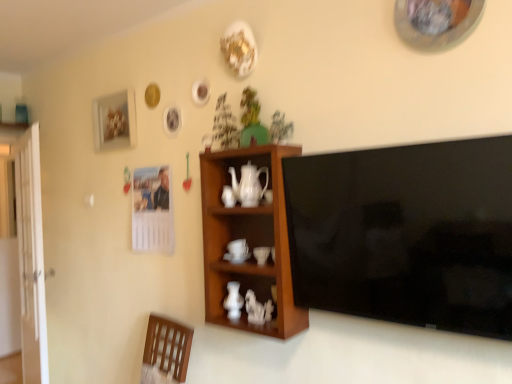
This screenshot has width=512, height=384. Find the location of `white glossy coffee cup at center, which ranks as the first coffee cup in front-to-back order`. white glossy coffee cup at center, which ranks as the first coffee cup in front-to-back order is located at coordinates (261, 255).

I want to click on matte white picture frame at upper left, so click(x=115, y=121).

Find the location of a particular element. This screenshot has width=512, height=384. white glossy vase at center is located at coordinates pyautogui.click(x=233, y=300).

Describe the element at coordinates (248, 241) in the screenshot. I see `wooden cabinet at center` at that location.

Locate an element on the screen. green matte houseplant at upper center, placed as the second houseplant when sorted from right to left is located at coordinates (225, 126).

What do you see at coordinates (225, 126) in the screenshot? I see `green matte houseplant at upper center, placed as the second houseplant when sorted from right to left` at bounding box center [225, 126].

This screenshot has height=384, width=512. Find the location of `white glossy coffee cup at center, the first coffee cup positioned from the right`. white glossy coffee cup at center, the first coffee cup positioned from the right is located at coordinates (261, 255).

Considering the relative sizes of white glossy vase at center and black glossy flat-screen tv at right in the image provided, is white glossy vase at center wider than black glossy flat-screen tv at right?

Incorrect, the width of white glossy vase at center does not surpass that of black glossy flat-screen tv at right.

Where is `vase that is behind the black glossy flat-screen tv at right`? vase that is behind the black glossy flat-screen tv at right is located at coordinates (233, 300).

Which is farther, (238, 292) or (283, 170)?

Positioned behind is point (238, 292).

Locate an element on the screen. This screenshot has width=512, height=384. the 1st coffee cup in front of the white glossy vase at center is located at coordinates click(238, 247).

Is white ceramic coffee cup at center, which ranks as the second coffee cup in right-to-left order, positioned before white glossy vase at center?

Yes, white ceramic coffee cup at center, which ranks as the second coffee cup in right-to-left order, is closer to the camera.

Does white ceramic coffee cup at center, the second coffee cup in the front-to-back sequence, have a lesser height compared to white glossy vase at center?

Yes, white ceramic coffee cup at center, the second coffee cup in the front-to-back sequence, is shorter than white glossy vase at center.

Considering the relative positions of white ceramic coffee cup at center, which ranks as the second coffee cup in right-to-left order, and white glossy vase at center in the image provided, is white ceramic coffee cup at center, which ranks as the second coffee cup in right-to-left order, to the left of white glossy vase at center from the viewer's perspective?

Incorrect, white ceramic coffee cup at center, which ranks as the second coffee cup in right-to-left order, is not on the left side of white glossy vase at center.

Do you think white glossy coffee cup at center, which appears as the 2th coffee cup when viewed from the back, is within wooden cabinet at center, or outside of it?

white glossy coffee cup at center, which appears as the 2th coffee cup when viewed from the back, is inside wooden cabinet at center.

Can you confirm if white glossy coffee cup at center, which appears as the 2th coffee cup when viewed from the back, is shorter than wooden cabinet at center?

Yes, white glossy coffee cup at center, which appears as the 2th coffee cup when viewed from the back, is shorter than wooden cabinet at center.

From a real-world perspective, does white glossy coffee cup at center, the first coffee cup positioned from the right, sit lower than wooden cabinet at center?

Yes.

Is white glossy coffee cup at center, which appears as the 2th coffee cup when viewed from the back, turned away from wooden cabinet at center?

Yes.

Which of these two, black glossy flat-screen tv at right or green matte houseplant at upper center, which is the first houseplant from right to left, is wider?

black glossy flat-screen tv at right is wider.

Are black glossy flat-screen tv at right and green matte houseplant at upper center, which is the first houseplant from right to left, located far from each other?

No, black glossy flat-screen tv at right is in close proximity to green matte houseplant at upper center, which is the first houseplant from right to left.

Can you tell me how much black glossy flat-screen tv at right and green matte houseplant at upper center, the 2th houseplant in the left-to-right sequence, differ in facing direction?

black glossy flat-screen tv at right and green matte houseplant at upper center, the 2th houseplant in the left-to-right sequence, are facing 1.69 degrees away from each other.

The width and height of the screenshot is (512, 384). I want to click on the 1st houseplant behind the black glossy flat-screen tv at right, starting your count from the anchor, so click(252, 120).

Which is behind, matte white picture frame at upper left or wooden cabinet at center?

matte white picture frame at upper left is further away from the camera.

Considering the positions of objects matte white picture frame at upper left and wooden cabinet at center in the image provided, who is more to the left, matte white picture frame at upper left or wooden cabinet at center?

Positioned to the left is matte white picture frame at upper left.

Does point (120, 100) come in front of point (246, 323)?

No, it is behind (246, 323).

This screenshot has height=384, width=512. I want to click on cabinetry lying below the matte white picture frame at upper left (from the image's perspective), so click(x=248, y=241).

Based on the photo, from the image's perspective, between white glossy door at left and white glossy coffee cup at center, which ranks as the first coffee cup in front-to-back order, which one is located above?

From the image's view, white glossy coffee cup at center, which ranks as the first coffee cup in front-to-back order, is above.

Between point (30, 259) and point (266, 254), which one is positioned in front?

The point (266, 254) is in front.

Is white glossy door at left bigger or smaller than white glossy coffee cup at center, the first coffee cup positioned from the right?

Clearly, white glossy door at left is larger in size than white glossy coffee cup at center, the first coffee cup positioned from the right.

Which of these two, white glossy door at left or white glossy coffee cup at center, which ranks as the first coffee cup in front-to-back order, is wider?

white glossy door at left is wider.

I want to click on houseplant that is the 2nd object located behind the white glossy coffee cup at center, which appears as the 2th coffee cup when viewed from the back, so click(x=225, y=126).

Considering the sizes of green matte houseplant at upper center, placed as the second houseplant when sorted from right to left, and white glossy coffee cup at center, the first coffee cup positioned from the right, in the image, is green matte houseplant at upper center, placed as the second houseplant when sorted from right to left, bigger or smaller than white glossy coffee cup at center, the first coffee cup positioned from the right,?

Considering their sizes, green matte houseplant at upper center, placed as the second houseplant when sorted from right to left, takes up more space than white glossy coffee cup at center, the first coffee cup positioned from the right.

From the image's perspective, which is below, green matte houseplant at upper center, the 1th houseplant in the left-to-right sequence, or white glossy coffee cup at center, which appears as the 2th coffee cup when viewed from the back?

From the image's view, white glossy coffee cup at center, which appears as the 2th coffee cup when viewed from the back, is below.

In terms of width, does green matte houseplant at upper center, the 1th houseplant in the left-to-right sequence, look wider or thinner when compared to white glossy coffee cup at center, which is the second coffee cup in left-to-right order?

Considering their sizes, green matte houseplant at upper center, the 1th houseplant in the left-to-right sequence, looks broader than white glossy coffee cup at center, which is the second coffee cup in left-to-right order.

This screenshot has width=512, height=384. In order to click on vase behind the black glossy flat-screen tv at right in this screenshot , I will do `click(233, 300)`.

Where is `the 1st coffee cup to the right when counting from the white glossy vase at center`? The height and width of the screenshot is (384, 512). the 1st coffee cup to the right when counting from the white glossy vase at center is located at coordinates (238, 247).

Based on the photo, estimate the real-world distances between objects in this image. Which object is further from green matte houseplant at upper center, the 1th houseplant in the left-to-right sequence, black glossy flat-screen tv at right or white ceramic coffee cup at center, which ranks as the second coffee cup in right-to-left order?

Among the two, black glossy flat-screen tv at right is located further to green matte houseplant at upper center, the 1th houseplant in the left-to-right sequence.

Considering their positions, is white glossy coffee cup at center, which is the second coffee cup in left-to-right order, positioned closer to green matte houseplant at upper center, placed as the second houseplant when sorted from right to left, than white glossy teapot at center?

white glossy teapot at center.

When comparing their distances from white glossy coffee cup at center, the first coffee cup positioned from the right, does black glossy flat-screen tv at right or green matte houseplant at upper center, the 1th houseplant in the left-to-right sequence, seem further?

green matte houseplant at upper center, the 1th houseplant in the left-to-right sequence.

Based on their spatial positions, is white glossy coffee cup at center, which is the second coffee cup in left-to-right order, or green matte houseplant at upper center, the 2th houseplant in the left-to-right sequence, further from white glossy teapot at center?

white glossy coffee cup at center, which is the second coffee cup in left-to-right order, is further to white glossy teapot at center.

When comparing their distances from green matte houseplant at upper center, the 2th houseplant in the left-to-right sequence, does green matte houseplant at upper center, placed as the second houseplant when sorted from right to left, or white glossy teapot at center seem further?

Among the two, white glossy teapot at center is located further to green matte houseplant at upper center, the 2th houseplant in the left-to-right sequence.

From the image, which object appears to be farther from white glossy coffee cup at center, which appears as the 2th coffee cup when viewed from the back, white glossy door at left or white glossy vase at center?

Among the two, white glossy door at left is located further to white glossy coffee cup at center, which appears as the 2th coffee cup when viewed from the back.

Which object lies further to the anchor point green matte houseplant at upper center, the 2th houseplant in the left-to-right sequence, white glossy door at left or wooden cabinet at center?

Based on the image, white glossy door at left appears to be further to green matte houseplant at upper center, the 2th houseplant in the left-to-right sequence.

From the image, which object appears to be farther from black glossy flat-screen tv at right, matte white picture frame at upper left or white ceramic coffee cup at center, which ranks as the second coffee cup in right-to-left order?

Among the two, matte white picture frame at upper left is located further to black glossy flat-screen tv at right.

Where is `coffee cup positioned between wooden cabinet at center and white ceramic coffee cup at center, acting as the first coffee cup starting from the back, from near to far`? coffee cup positioned between wooden cabinet at center and white ceramic coffee cup at center, acting as the first coffee cup starting from the back, from near to far is located at coordinates (261, 255).

At what (x,y) coordinates should I click in order to perform the action: click on coffee cup between matte white picture frame at upper left and wooden cabinet at center from left to right. Please return your answer as a coordinate pair (x, y). The width and height of the screenshot is (512, 384). Looking at the image, I should click on (238, 247).

At what (x,y) coordinates should I click in order to perform the action: click on houseplant situated between white glossy door at left and white glossy vase at center from left to right. Please return your answer as a coordinate pair (x, y). Looking at the image, I should click on (225, 126).

Locate an element on the screen. The height and width of the screenshot is (384, 512). coffee cup between white ceramic coffee cup at center, which ranks as the second coffee cup in right-to-left order, and white glossy vase at center vertically is located at coordinates (261, 255).